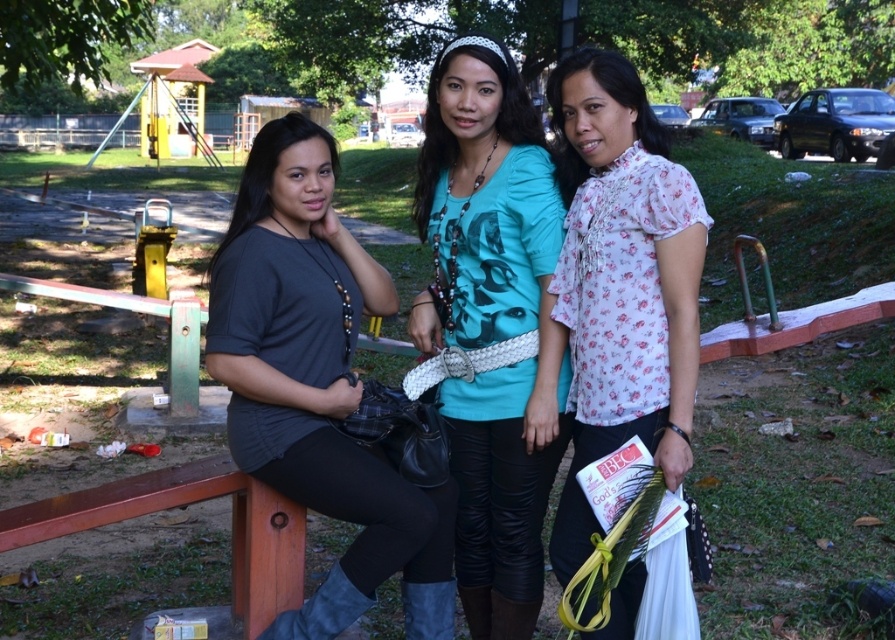
Between point (435, 84) and point (680, 403), which one is positioned in front?

Point (680, 403) is in front.

Can you confirm if teal printed shirt at center is positioned above white floral blouse at center?

No, teal printed shirt at center is not above white floral blouse at center.

The height and width of the screenshot is (640, 895). What do you see at coordinates (491, 324) in the screenshot?
I see `teal printed shirt at center` at bounding box center [491, 324].

At what (x,y) coordinates should I click in order to perform the action: click on teal printed shirt at center. Please return your answer as a coordinate pair (x, y). Looking at the image, I should click on (491, 324).

Is matte black shirt at left thinner than white floral blouse at center?

A: Incorrect, matte black shirt at left's width is not less than white floral blouse at center's.

Find the location of `matte black shirt at left`. matte black shirt at left is located at coordinates (316, 384).

What are the coordinates of `matte black shirt at left` in the screenshot? It's located at (316, 384).

At what (x,y) coordinates should I click in order to perform the action: click on matte black shirt at left. Please return your answer as a coordinate pair (x, y). Looking at the image, I should click on (316, 384).

Is teal printed shirt at center to the right of matte black shirt at left from the viewer's perspective?

Indeed, teal printed shirt at center is positioned on the right side of matte black shirt at left.

Between teal printed shirt at center and matte black shirt at left, which one appears on the right side from the viewer's perspective?

teal printed shirt at center

Is point (503, 420) closer to camera compared to point (220, 278)?

No, it is not.

Where is `teal printed shirt at center`? teal printed shirt at center is located at coordinates (491, 324).